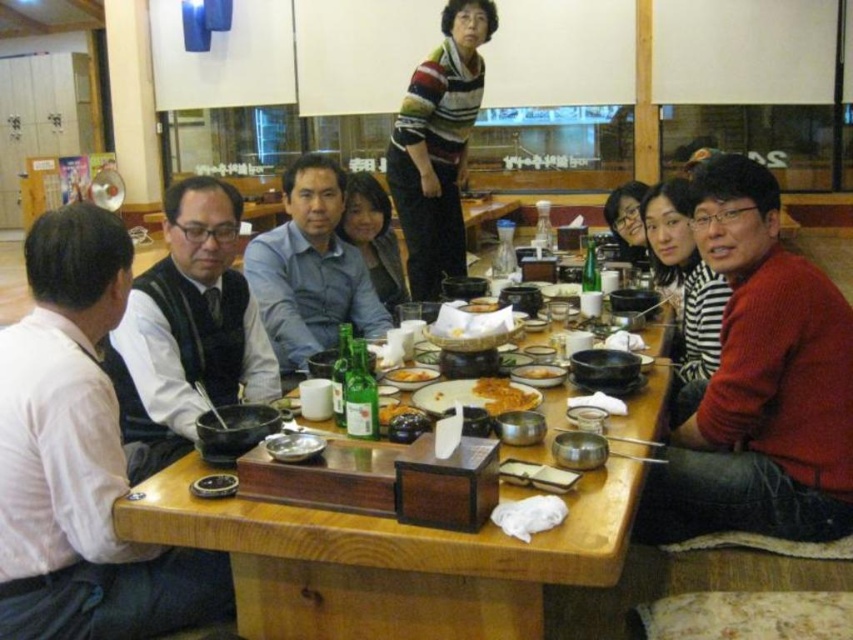
Can you confirm if white shirt at left is taller than blue cotton shirt at center?

Yes.

Can you confirm if white shirt at left is wider than blue cotton shirt at center?

No, white shirt at left is not wider than blue cotton shirt at center.

In order to click on white shirt at left in this screenshot , I will do `click(80, 458)`.

Which of these two, white shirt at left or matte gray shirt at center, stands shorter?

matte gray shirt at center is shorter.

Does white shirt at left appear on the left side of matte gray shirt at center?

Indeed, white shirt at left is positioned on the left side of matte gray shirt at center.

The width and height of the screenshot is (853, 640). Identify the location of white shirt at left. (80, 458).

Identify the location of matte black shirt at upper right. (627, 220).

Which is in front, point (631, 250) or point (427, 369)?

Point (427, 369)

The height and width of the screenshot is (640, 853). What do you see at coordinates (627, 220) in the screenshot?
I see `matte black shirt at upper right` at bounding box center [627, 220].

Identify the location of matte black shirt at upper right. Image resolution: width=853 pixels, height=640 pixels. (627, 220).